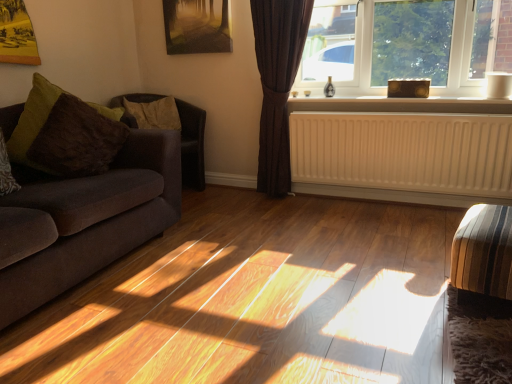
Question: Should I look upward or downward to see velvet dark brown couch at left?

Choices:
 (A) up
 (B) down

Answer: (A)

Question: Is matte brown window at upper right outside of striped fabric armchair at lower right, positioned as the first armchair in right-to-left order?

Choices:
 (A) no
 (B) yes

Answer: (B)

Question: Is matte brown window at upper right aimed at striped fabric armchair at lower right, acting as the 1th armchair starting from the bottom?

Choices:
 (A) yes
 (B) no

Answer: (B)

Question: Does matte brown window at upper right have a smaller size compared to striped fabric armchair at lower right, the second armchair from the back?

Choices:
 (A) yes
 (B) no

Answer: (B)

Question: Can you confirm if matte brown window at upper right is taller than striped fabric armchair at lower right, the second armchair from the back?

Choices:
 (A) no
 (B) yes

Answer: (B)

Question: Is matte brown window at upper right in contact with striped fabric armchair at lower right, placed as the 2th armchair when sorted from left to right?

Choices:
 (A) yes
 (B) no

Answer: (B)

Question: Is matte brown window at upper right to the left of striped fabric armchair at lower right, the second armchair from the back, from the viewer's perspective?

Choices:
 (A) yes
 (B) no

Answer: (A)

Question: Can we say brown leather armchair at left, acting as the first armchair starting from the top, lies outside matte brown window at upper right?

Choices:
 (A) yes
 (B) no

Answer: (A)

Question: From the image's perspective, is brown leather armchair at left, marked as the second armchair in a bottom-to-top arrangement, on matte brown window at upper right?

Choices:
 (A) no
 (B) yes

Answer: (A)

Question: Does brown leather armchair at left, acting as the first armchair starting from the top, turn towards matte brown window at upper right?

Choices:
 (A) no
 (B) yes

Answer: (A)

Question: Is brown leather armchair at left, marked as the second armchair in a bottom-to-top arrangement, positioned in front of matte brown window at upper right?

Choices:
 (A) no
 (B) yes

Answer: (A)

Question: Is brown leather armchair at left, which ranks as the 1th armchair in back-to-front order, taller than matte brown window at upper right?

Choices:
 (A) no
 (B) yes

Answer: (B)

Question: Is matte brown window at upper right a part of brown leather armchair at left, acting as the first armchair starting from the top?

Choices:
 (A) no
 (B) yes

Answer: (A)

Question: Is brown textured pillow at left, which appears as the second pillow when viewed from the front, looking in the opposite direction of matte brown window at upper right?

Choices:
 (A) yes
 (B) no

Answer: (B)